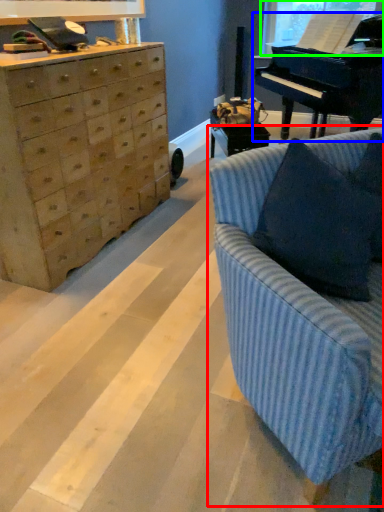
Question: Which is nearer to the studio couch (highlighted by a red box)? piano (highlighted by a blue box) or window screen (highlighted by a green box).

Choices:
 (A) piano
 (B) window screen

Answer: (A)